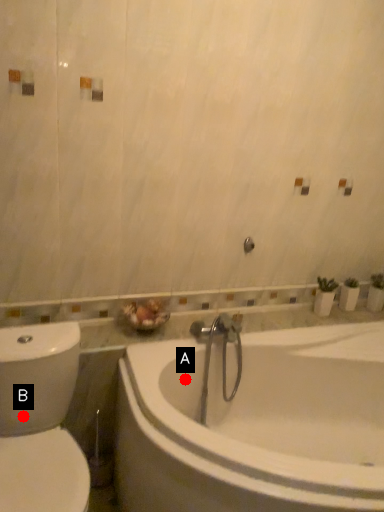
Question: Two points are circled on the image, labeled by A and B beside each circle. Among these points, which one is farthest from the camera?

Choices:
 (A) A is further
 (B) B is further

Answer: (A)